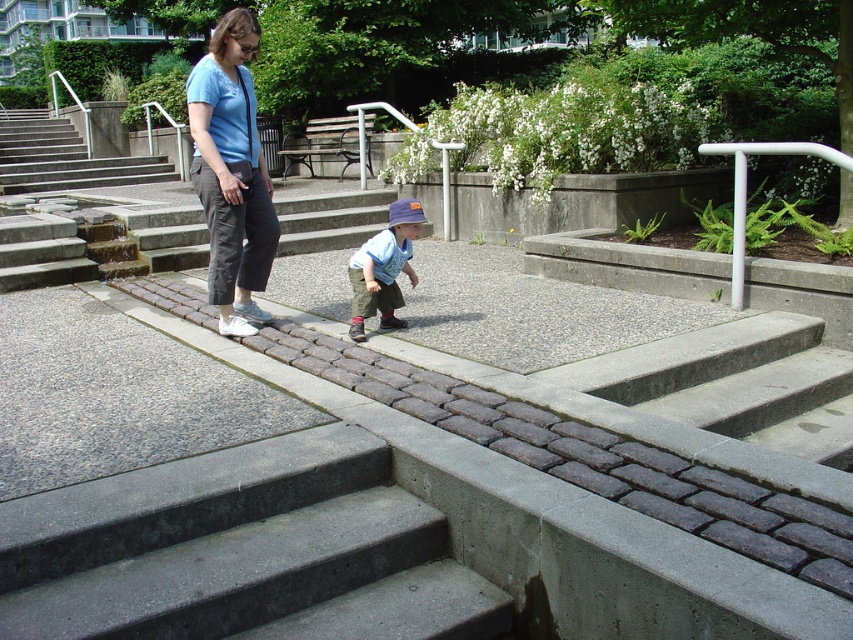
You are a maintenance worker inspecting the park facilities. You notice the concrete steps at upper left and the silver metallic handrail at upper right. Which structure requires more effort to climb due to its height?

The concrete steps at upper left requires more effort to climb due to its height compared to the silver metallic handrail at upper right as it is much taller.

You are a delivery person carrying a large box that measures 5 feet in length. You need to navigate through the space between the matte blue shirt at center and the silver metallic handrail at upper right. Can you pass through this space without tilting the box?

The distance between the matte blue shirt at center and the silver metallic handrail at upper right is 7.28 feet. Since the box is 5 feet long, there is enough space to pass through without tilting it.